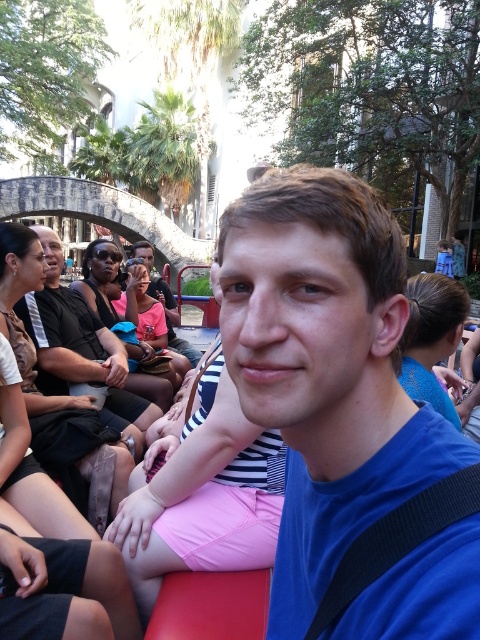
Is point (422, 541) farther from viewer compared to point (72, 349)?

No, (422, 541) is in front of (72, 349).

Is blue matte shirt at center closer to the viewer compared to matte black shirt at center?

Yes, blue matte shirt at center is in front of matte black shirt at center.

The height and width of the screenshot is (640, 480). What are the coordinates of `blue matte shirt at center` in the screenshot? It's located at (324, 369).

Is blue matte shirt at center wider than matte pink shirt at center?

Incorrect, blue matte shirt at center's width does not surpass matte pink shirt at center's.

From the picture: Between blue matte shirt at center and matte pink shirt at center, which one has more height?

With more height is blue matte shirt at center.

Who is more distant from viewer, (269, 314) or (157, 282)?

The point (157, 282) is behind.

The width and height of the screenshot is (480, 640). Find the location of `blue matte shirt at center`. blue matte shirt at center is located at coordinates (324, 369).

Is matte black shirt at center positioned behind matte pink shirt at center?

No, matte black shirt at center is in front of matte pink shirt at center.

Is point (68, 330) positioned after point (167, 298)?

No, it is in front of (167, 298).

The width and height of the screenshot is (480, 640). I want to click on matte black shirt at center, so click(x=80, y=346).